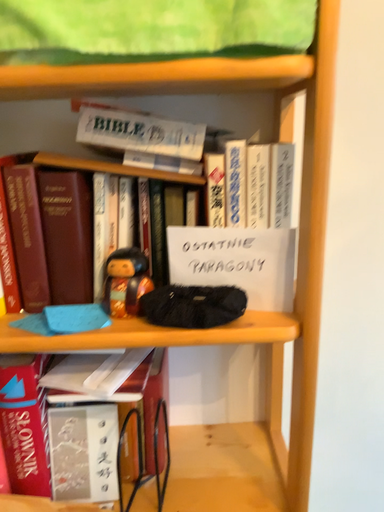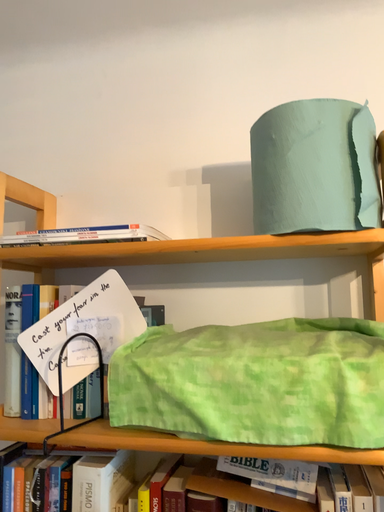
Question: How did the camera likely rotate when shooting the video?

Choices:
 (A) rotated downward
 (B) rotated upward

Answer: (B)